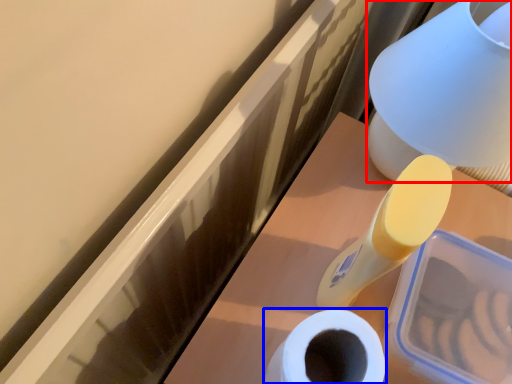
Question: Among these objects, which one is nearest to the camera, table lamp (highlighted by a red box) or toilet paper (highlighted by a blue box)?

Choices:
 (A) table lamp
 (B) toilet paper

Answer: (A)